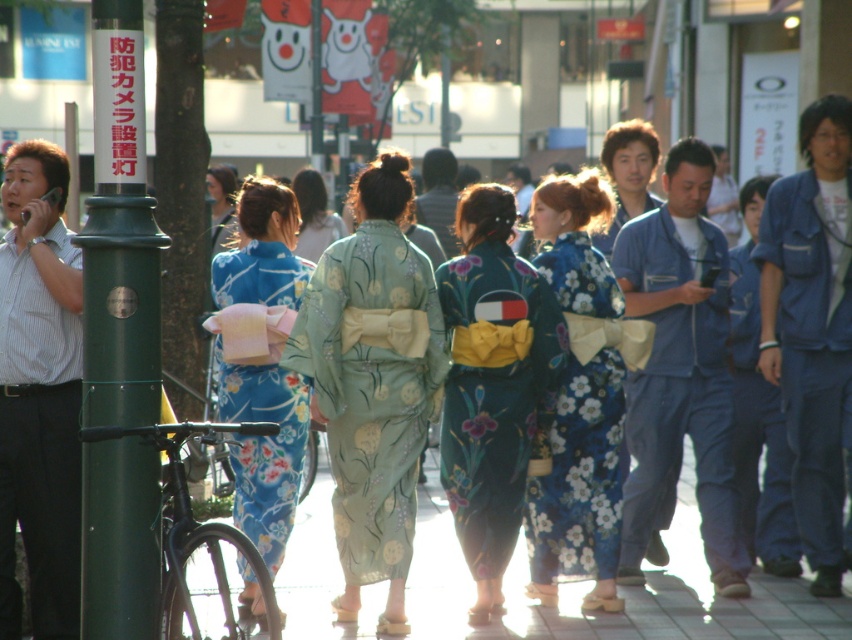
Who is more distant from viewer, (246, 458) or (444, 208)?

The point (444, 208) is more distant.

Between point (252, 252) and point (433, 179), which one is positioned in front?

Positioned in front is point (252, 252).

Find the location of a particular element. The width and height of the screenshot is (852, 640). blue floral kimono at left is located at coordinates (265, 451).

Can you confirm if light green floral kimono at center is taller than light green silk kimono at center?

Correct, light green floral kimono at center is much taller as light green silk kimono at center.

Is light green floral kimono at center positioned at the back of light green silk kimono at center?

No, light green floral kimono at center is closer to the viewer.

Locate an element on the screen. light green floral kimono at center is located at coordinates (373, 381).

The height and width of the screenshot is (640, 852). What do you see at coordinates (39, 394) in the screenshot?
I see `striped cotton shirt at left` at bounding box center [39, 394].

Is striped cotton shirt at left positioned behind denim jacket at right?

No, striped cotton shirt at left is in front of denim jacket at right.

Locate an element on the screen. striped cotton shirt at left is located at coordinates [x=39, y=394].

Find the location of a particular element. This screenshot has width=852, height=640. striped cotton shirt at left is located at coordinates (39, 394).